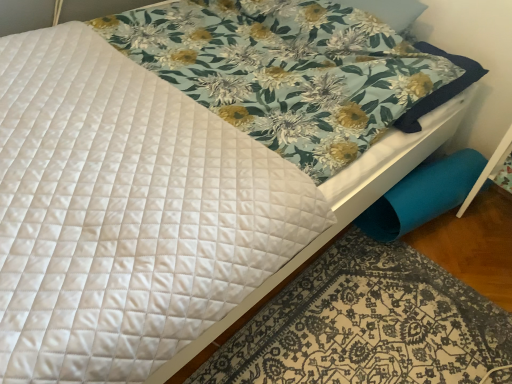
Image resolution: width=512 pixels, height=384 pixels. Describe the element at coordinates (422, 196) in the screenshot. I see `blue fabric swivel chair at lower right` at that location.

Locate an element on the screen. blue fabric swivel chair at lower right is located at coordinates (422, 196).

What is the approximate height of blue fabric swivel chair at lower right?

7.97 inches.

This screenshot has width=512, height=384. What are the coordinates of `blue fabric at lower right` in the screenshot? It's located at (367, 324).

This screenshot has width=512, height=384. Describe the element at coordinates (367, 324) in the screenshot. I see `blue fabric at lower right` at that location.

What are the coordinates of `blue fabric swivel chair at lower right` in the screenshot? It's located at (422, 196).

Considering the relative positions of blue fabric swivel chair at lower right and blue fabric at lower right in the image provided, is blue fabric swivel chair at lower right to the left or to the right of blue fabric at lower right?

blue fabric swivel chair at lower right is positioned on blue fabric at lower right's right side.

Considering the positions of objects blue fabric swivel chair at lower right and blue fabric at lower right in the image provided, who is behind, blue fabric swivel chair at lower right or blue fabric at lower right?

blue fabric swivel chair at lower right is further from the camera.

Which is less distant, [445,182] or [424,373]?

Point [445,182] is positioned farther from the camera compared to point [424,373].

From the image's perspective, would you say blue fabric swivel chair at lower right is shown under blue fabric at lower right?

No.

From a real-world perspective, relative to blue fabric at lower right, is blue fabric swivel chair at lower right vertically above or below?

Clearly, from a real-world perspective, blue fabric swivel chair at lower right is above blue fabric at lower right.

Which of these two, blue fabric swivel chair at lower right or blue fabric at lower right, is wider?

blue fabric at lower right is wider.

From their relative heights in the image, would you say blue fabric swivel chair at lower right is taller or shorter than blue fabric at lower right?

In the image, blue fabric swivel chair at lower right appears to be taller than blue fabric at lower right.

In terms of size, does blue fabric swivel chair at lower right appear bigger or smaller than blue fabric at lower right?

In the image, blue fabric swivel chair at lower right appears to be smaller than blue fabric at lower right.

Would you say blue fabric swivel chair at lower right is outside blue fabric at lower right?

That's correct, blue fabric swivel chair at lower right is outside of blue fabric at lower right.

Are blue fabric swivel chair at lower right and blue fabric at lower right far apart?

They are positioned close to each other.

Is blue fabric swivel chair at lower right positioned with its back to blue fabric at lower right?

That's not correct — blue fabric swivel chair at lower right is not looking away from blue fabric at lower right.

Image resolution: width=512 pixels, height=384 pixels. I want to click on mat on the left of blue fabric swivel chair at lower right, so click(x=367, y=324).

In the scene shown: Would you say blue fabric at lower right is to the left or to the right of blue fabric swivel chair at lower right in the picture?

Based on their positions, blue fabric at lower right is located to the left of blue fabric swivel chair at lower right.

Is the depth of blue fabric at lower right greater than that of blue fabric swivel chair at lower right?

No, it is in front of blue fabric swivel chair at lower right.

Does point (423, 301) come in front of point (438, 201)?

Yes.

From the image's perspective, which is above, blue fabric at lower right or blue fabric swivel chair at lower right?

blue fabric swivel chair at lower right, from the image's perspective.

From a real-world perspective, who is located lower, blue fabric at lower right or blue fabric swivel chair at lower right?

From a 3D spatial view, blue fabric at lower right is below.

Between blue fabric at lower right and blue fabric swivel chair at lower right, which one has smaller width?

Thinner between the two is blue fabric swivel chair at lower right.

Who is taller, blue fabric at lower right or blue fabric swivel chair at lower right?

With more height is blue fabric swivel chair at lower right.

Considering the sizes of objects blue fabric at lower right and blue fabric swivel chair at lower right in the image provided, who is smaller, blue fabric at lower right or blue fabric swivel chair at lower right?

blue fabric swivel chair at lower right.

Is blue fabric swivel chair at lower right surrounded by blue fabric at lower right?

That's incorrect, blue fabric swivel chair at lower right is not inside blue fabric at lower right.

Would you consider blue fabric at lower right to be distant from blue fabric swivel chair at lower right?

Actually, blue fabric at lower right and blue fabric swivel chair at lower right are a little close together.

Is blue fabric at lower right facing towards blue fabric swivel chair at lower right?

No.

What's the angular difference between blue fabric at lower right and blue fabric swivel chair at lower right's facing directions?

There is a 80-degree angle between the facing directions of blue fabric at lower right and blue fabric swivel chair at lower right.

Measure the distance between blue fabric at lower right and blue fabric swivel chair at lower right.

blue fabric at lower right and blue fabric swivel chair at lower right are 39.17 centimeters apart from each other.

Find the location of a particular element. The height and width of the screenshot is (384, 512). mat located on the left of blue fabric swivel chair at lower right is located at coordinates (367, 324).

There is a blue fabric at lower right. What are the coordinates of `swivel chair above it (from a real-world perspective)` in the screenshot? It's located at (x=422, y=196).

You are a GUI agent. You are given a task and a screenshot of the screen. Output one action in this format:
    pyautogui.click(x=<x>, y=<y>)
    Task: Click on the swivel chair on the right side of blue fabric at lower right
    The image size is (512, 384).
    Given the screenshot: What is the action you would take?
    pyautogui.click(x=422, y=196)